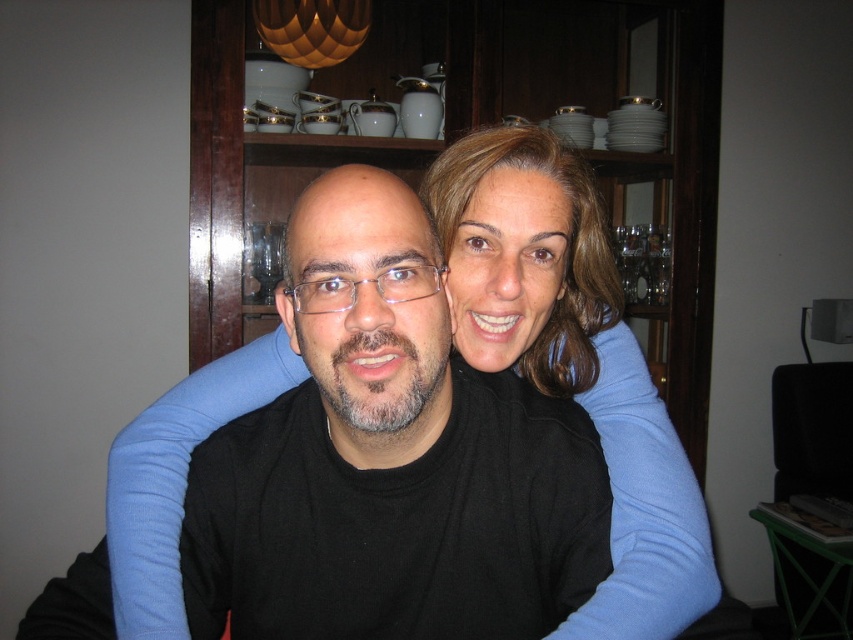
You are a photographer setting up for a portrait session. You want to ensure that both the black matte shirt at center and the smooth brown hair at center are clearly visible in the photo. Based on their positions, which object should you adjust to bring into focus first?

The smooth brown hair at center is behind the black matte shirt at center, so you should adjust the focus to ensure the black matte shirt at center is in focus first, as it is closer to the camera. This way, both objects can be captured clearly.

You are a photographer setting up a portrait shoot. You notice the black matte shirt at center and the smooth brown hair at center in your frame. Which object should you adjust your focus on if you want to ensure the taller one is in sharp focus?

The black matte shirt at center is taller than the smooth brown hair at center, so you should focus on the black matte shirt at center to ensure the taller object is in sharp focus.